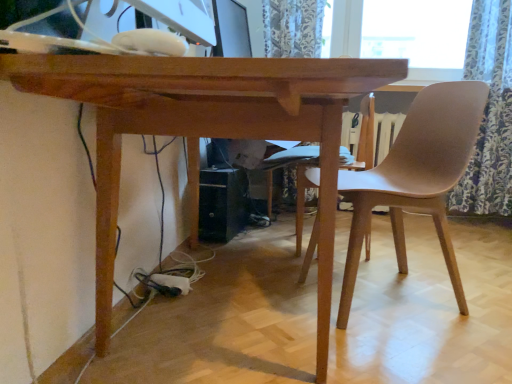
Measure the distance between point [93,70] and camera.

70.30 centimeters.

The image size is (512, 384). What do you see at coordinates (489, 112) in the screenshot?
I see `floral fabric curtain at right` at bounding box center [489, 112].

This screenshot has width=512, height=384. What do you see at coordinates (416, 176) in the screenshot? I see `matte brown chair at right` at bounding box center [416, 176].

What is the approximate width of matte black monitor at upper center?

It is 9.18 inches.

You are a GUI agent. You are given a task and a screenshot of the screen. Output one action in this format:
    pyautogui.click(x=<x>, y=<y>)
    Task: Click on the wooden table at center
    This screenshot has height=384, width=512.
    Given the screenshot: What is the action you would take?
    pyautogui.click(x=205, y=129)

Considering the sizes of objects wooden table at center and matte black monitor at upper center in the image provided, who is shorter, wooden table at center or matte black monitor at upper center?

With less height is matte black monitor at upper center.

Where is `table below the matte black monitor at upper center (from a real-world perspective)`? table below the matte black monitor at upper center (from a real-world perspective) is located at coordinates (205, 129).

Which object is closer to the camera taking this photo, wooden table at center or matte black monitor at upper center?

wooden table at center.

Looking at this image, is wooden table at center far away from white glossy monitor at upper center?

No, wooden table at center is not far from white glossy monitor at upper center.

Between point (106, 80) and point (181, 47), which one is positioned behind?

The point (106, 80) is farther from the camera.

From the image's perspective, between wooden table at center and white glossy monitor at upper center, who is located below?

wooden table at center appears lower in the image.

Does wooden table at center have a greater width compared to white glossy monitor at upper center?

Correct, the width of wooden table at center exceeds that of white glossy monitor at upper center.

Is matte black monitor at upper center inside floral fabric curtain at right?

Actually, matte black monitor at upper center is outside floral fabric curtain at right.

Are floral fabric curtain at right and matte black monitor at upper center located far from each other?

Absolutely, floral fabric curtain at right is distant from matte black monitor at upper center.

Locate an element on the screen. curtain on the right of matte black monitor at upper center is located at coordinates (489, 112).

Can you confirm if wooden table at center is bigger than floral fabric curtain at right?

Yes.

Looking at this image, would you say wooden table at center is inside or outside floral fabric curtain at right?

wooden table at center is not enclosed by floral fabric curtain at right.

Does point (185, 83) lie in front of point (456, 186)?

Yes.

From a real-world perspective, is wooden table at center physically above floral fabric curtain at right?

No, from a real-world perspective, wooden table at center is not above floral fabric curtain at right.

Who is bigger, matte brown chair at right or floral fabric curtain at right?

With larger size is matte brown chair at right.

Looking at their sizes, would you say matte brown chair at right is wider or thinner than floral fabric curtain at right?

Clearly, matte brown chair at right has more width compared to floral fabric curtain at right.

Looking at this image, can you confirm if matte brown chair at right is positioned to the right of floral fabric curtain at right?

No.

From the image's perspective, relative to floral fabric curtain at right, is matte brown chair at right above or below?

Clearly, from the image's perspective, matte brown chair at right is below floral fabric curtain at right.

From the image's perspective, relative to floral fabric curtain at right, is white glossy monitor at upper center above or below?

white glossy monitor at upper center is situated lower than floral fabric curtain at right in the image.

From a real-world perspective, which object rests below the other?

From a 3D spatial view, floral fabric curtain at right is below.

In terms of size, does white glossy monitor at upper center appear bigger or smaller than floral fabric curtain at right?

white glossy monitor at upper center is smaller than floral fabric curtain at right.

Is white glossy monitor at upper center surrounding floral fabric curtain at right?

No, white glossy monitor at upper center does not contain floral fabric curtain at right.

In the scene shown: How many degrees apart are the facing directions of matte black monitor at upper center and floral fabric curtain at right?

There is a 94.5-degree angle between the facing directions of matte black monitor at upper center and floral fabric curtain at right.

Would you say matte black monitor at upper center is to the left or to the right of floral fabric curtain at right in the picture?

Clearly, matte black monitor at upper center is on the left of floral fabric curtain at right in the image.

Are matte black monitor at upper center and floral fabric curtain at right making contact?

No.

From a real-world perspective, between matte black monitor at upper center and floral fabric curtain at right, who is vertically higher?

matte black monitor at upper center.

Find the location of a particular element. table in front of the matte black monitor at upper center is located at coordinates (205, 129).

Identify the location of desktop computer above the wooden table at center (from a real-world perspective). click(x=90, y=42).

When comparing their distances from matte black monitor at upper center, does white glossy monitor at upper center or wooden table at center seem closer?

wooden table at center is closer to matte black monitor at upper center.

Based on their spatial positions, is wooden table at center or white glossy monitor at upper center closer to floral fabric curtain at right?

Based on the image, wooden table at center appears to be nearer to floral fabric curtain at right.

Which object lies nearer to the anchor point floral fabric curtain at right, wooden table at center or matte brown chair at right?

matte brown chair at right is positioned closer to the anchor floral fabric curtain at right.

From the picture: When comparing their distances from white glossy monitor at upper center, does matte black monitor at upper center or matte brown chair at right seem further?

Based on the image, matte black monitor at upper center appears to be further to white glossy monitor at upper center.

Looking at this image, considering their positions, is floral fabric curtain at right positioned further to matte black monitor at upper center than matte brown chair at right?

Among the two, floral fabric curtain at right is located further to matte black monitor at upper center.

Estimate the real-world distances between objects in this image. Which object is closer to matte brown chair at right, wooden table at center or white glossy monitor at upper center?

wooden table at center lies closer to matte brown chair at right than the other object.

Which object lies nearer to the anchor point white glossy monitor at upper center, wooden table at center or matte brown chair at right?

wooden table at center.

When comparing their distances from wooden table at center, does matte black monitor at upper center or floral fabric curtain at right seem further?

floral fabric curtain at right is positioned further to the anchor wooden table at center.

At what (x,y) coordinates should I click in order to perform the action: click on table between white glossy monitor at upper center and floral fabric curtain at right along the z-axis. Please return your answer as a coordinate pair (x, y). The height and width of the screenshot is (384, 512). Looking at the image, I should click on (205, 129).

Find the location of a particular element. chair positioned between white glossy monitor at upper center and matte black monitor at upper center from near to far is located at coordinates (416, 176).

Where is `table located between white glossy monitor at upper center and matte brown chair at right in the depth direction`? The width and height of the screenshot is (512, 384). table located between white glossy monitor at upper center and matte brown chair at right in the depth direction is located at coordinates (205, 129).

Where is `chair situated between matte black monitor at upper center and floral fabric curtain at right from left to right`? Image resolution: width=512 pixels, height=384 pixels. chair situated between matte black monitor at upper center and floral fabric curtain at right from left to right is located at coordinates (416, 176).